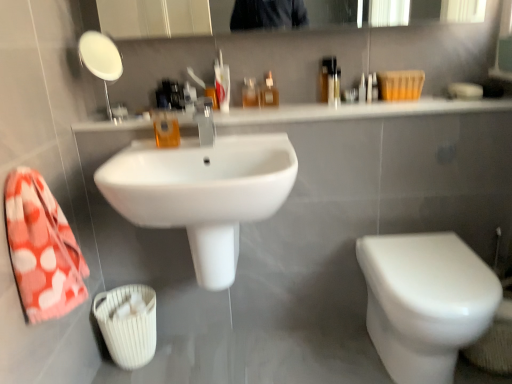
The height and width of the screenshot is (384, 512). What do you see at coordinates (356, 111) in the screenshot? I see `white glossy sink at upper center` at bounding box center [356, 111].

What is the approximate height of translucent plastic bottle at center, the 2th mouthwash from the right?

The height of translucent plastic bottle at center, the 2th mouthwash from the right, is 4.79 inches.

This screenshot has height=384, width=512. Find the location of `translucent plastic bottle at center, positioned as the second mouthwash in left-to-right order`. translucent plastic bottle at center, positioned as the second mouthwash in left-to-right order is located at coordinates (250, 93).

What is the approximate width of translucent plastic mouthwash at center, arranged as the 1th mouthwash when viewed from the front?

3.09 inches.

Find the location of a particular element. This screenshot has width=512, height=384. white glossy sink at upper center is located at coordinates (356, 111).

How many degrees apart are the facing directions of white glossy sink at upper center and white glossy mirror at upper left?

The facing directions of white glossy sink at upper center and white glossy mirror at upper left are 1.05 degrees apart.

Relative to white glossy mirror at upper left, is white glossy sink at upper center in front or behind?

Visually, white glossy sink at upper center is located behind white glossy mirror at upper left.

Considering the relative sizes of white glossy sink at upper center and white glossy mirror at upper left in the image provided, is white glossy sink at upper center smaller than white glossy mirror at upper left?

Incorrect, white glossy sink at upper center is not smaller in size than white glossy mirror at upper left.

From the image's perspective, which one is positioned lower, white glossy sink at upper center or white glossy mirror at upper left?

white glossy sink at upper center appears lower in the image.

Between translucent plastic bottle at center, the 2th mouthwash from the right, and white glossy toilet at lower right, which one appears on the right side from the viewer's perspective?

white glossy toilet at lower right.

Are translucent plastic bottle at center, positioned as the second mouthwash in left-to-right order, and white glossy toilet at lower right located far from each other?

No, translucent plastic bottle at center, positioned as the second mouthwash in left-to-right order, is not far away from white glossy toilet at lower right.

Is translucent plastic bottle at center, positioned as the second mouthwash in left-to-right order, wider than white glossy toilet at lower right?

No.

Considering the positions of objects translucent plastic bottle at center, acting as the first mouthwash starting from the back, and white glossy toilet at lower right in the image provided, who is behind, translucent plastic bottle at center, acting as the first mouthwash starting from the back, or white glossy toilet at lower right?

translucent plastic bottle at center, acting as the first mouthwash starting from the back, is further from the camera.

Which is in front, point (276, 117) or point (274, 89)?

The point (276, 117) is in front.

Does white glossy sink at upper center lie in front of translucent plastic bottle at upper center, which ranks as the 2th mouthwash in back-to-front order?

Yes, it is.

Which object is thinner, white glossy sink at upper center or translucent plastic bottle at upper center, the third mouthwash viewed from the left?

With smaller width is translucent plastic bottle at upper center, the third mouthwash viewed from the left.

Does white glossy sink at upper center appear on the right side of translucent plastic bottle at upper center, which ranks as the 2th mouthwash in back-to-front order?

Yes, white glossy sink at upper center is to the right of translucent plastic bottle at upper center, which ranks as the 2th mouthwash in back-to-front order.

Is white glossy sink at center at the back of translucent plastic mouthwash at center, placed as the first mouthwash when sorted from left to right?

No, translucent plastic mouthwash at center, placed as the first mouthwash when sorted from left to right,'s orientation is not away from white glossy sink at center.

From the image's perspective, is translucent plastic mouthwash at center, the third mouthwash in the right-to-left sequence, located beneath white glossy sink at center?

Actually, translucent plastic mouthwash at center, the third mouthwash in the right-to-left sequence, appears above white glossy sink at center in the image.

Considering the positions of point (168, 134) and point (251, 153), is point (168, 134) closer or farther from the camera than point (251, 153)?

Point (168, 134) appears to be farther away from the viewer than point (251, 153).

Is translucent plastic mouthwash at center, arranged as the 1th mouthwash when viewed from the front, in front of or behind white glossy sink at center in the image?

translucent plastic mouthwash at center, arranged as the 1th mouthwash when viewed from the front, is positioned farther from the viewer than white glossy sink at center.

Considering the relative sizes of white glossy sink at upper center and satin nickel faucet at center in the image provided, is white glossy sink at upper center bigger than satin nickel faucet at center?

Yes, white glossy sink at upper center is bigger than satin nickel faucet at center.

In order to click on tap on the left side of white glossy sink at upper center in this screenshot , I will do `click(205, 121)`.

From the picture: In terms of height, does white glossy sink at upper center look taller or shorter compared to satin nickel faucet at center?

In the image, white glossy sink at upper center appears to be shorter than satin nickel faucet at center.

In the scene shown: From a real-world perspective, relative to orange polka dot towel at left, is white glossy sink at center vertically above or below?

From a real-world perspective, white glossy sink at center is physically below orange polka dot towel at left.

Is white glossy sink at center closer to camera compared to orange polka dot towel at left?

No, it is behind orange polka dot towel at left.

Visually, is white glossy sink at upper center positioned to the left or to the right of white glossy toilet at lower right?

From the image, it's evident that white glossy sink at upper center is to the left of white glossy toilet at lower right.

Where is `counter top behind the white glossy toilet at lower right`? The image size is (512, 384). counter top behind the white glossy toilet at lower right is located at coordinates (356, 111).

Does white glossy sink at upper center turn towards white glossy toilet at lower right?

No, white glossy sink at upper center is not facing towards white glossy toilet at lower right.

At what (x,y) coordinates should I click in order to perform the action: click on counter top below the white glossy mirror at upper left (from the image's perspective). Please return your answer as a coordinate pair (x, y). The width and height of the screenshot is (512, 384). Looking at the image, I should click on (356, 111).

Which mouthwash is the 2nd one when counting from the left side of the white glossy toilet at lower right? Please provide its 2D coordinates.

[(250, 93)]

Considering their positions, is translucent plastic mouthwash at center, the third mouthwash in the right-to-left sequence, positioned further to translucent plastic bottle at center, which ranks as the 3th mouthwash in front-to-back order, than satin nickel faucet at center?

Based on the image, translucent plastic mouthwash at center, the third mouthwash in the right-to-left sequence, appears to be further to translucent plastic bottle at center, which ranks as the 3th mouthwash in front-to-back order.

Looking at the image, which one is located further to orange polka dot towel at left, translucent plastic bottle at upper center, the third mouthwash viewed from the left, or white glossy sink at upper center?

translucent plastic bottle at upper center, the third mouthwash viewed from the left, is positioned further to the anchor orange polka dot towel at left.

From the image, which object appears to be nearer to translucent plastic mouthwash at center, arranged as the 1th mouthwash when viewed from the front, translucent plastic bottle at upper center, which is the 2th mouthwash in front-to-back order, or translucent plastic bottle at center, the 2th mouthwash from the right?

Among the two, translucent plastic bottle at center, the 2th mouthwash from the right, is located nearer to translucent plastic mouthwash at center, arranged as the 1th mouthwash when viewed from the front.

From the image, which object appears to be nearer to white glossy toilet at lower right, translucent plastic mouthwash at center, the third mouthwash in the right-to-left sequence, or satin nickel faucet at center?

satin nickel faucet at center is positioned closer to the anchor white glossy toilet at lower right.

Which object lies further to the anchor point white glossy toilet at lower right, orange polka dot towel at left or white glossy sink at upper center?

orange polka dot towel at left is positioned further to the anchor white glossy toilet at lower right.

Estimate the real-world distances between objects in this image. Which object is closer to translucent plastic mouthwash at center, the third mouthwash in the right-to-left sequence, white glossy mirror at upper left or white glossy sink at center?

white glossy sink at center lies closer to translucent plastic mouthwash at center, the third mouthwash in the right-to-left sequence, than the other object.

Which object lies further to the anchor point white glossy toilet at lower right, orange polka dot towel at left or satin nickel faucet at center?

orange polka dot towel at left is further to white glossy toilet at lower right.

Based on their spatial positions, is translucent plastic bottle at upper center, which ranks as the 2th mouthwash in back-to-front order, or orange polka dot towel at left further from white glossy sink at upper center?

orange polka dot towel at left.

Find the location of a particular element. The image size is (512, 384). counter top positioned between satin nickel faucet at center and translucent plastic bottle at center, the 2th mouthwash from the right, from near to far is located at coordinates (356, 111).

This screenshot has height=384, width=512. I want to click on counter top between translucent plastic bottle at upper center, the 1th mouthwash when ordered from right to left, and white glossy toilet at lower right vertically, so click(x=356, y=111).

The width and height of the screenshot is (512, 384). What are the coordinates of `tap between translucent plastic mouthwash at center, arranged as the 1th mouthwash when viewed from the front, and translucent plastic bottle at upper center, the third mouthwash viewed from the left` in the screenshot? It's located at (205, 121).

Find the location of a particular element. This screenshot has width=512, height=384. mirror between orange polka dot towel at left and translucent plastic bottle at upper center, which ranks as the 2th mouthwash in back-to-front order, in the horizontal direction is located at coordinates (101, 59).